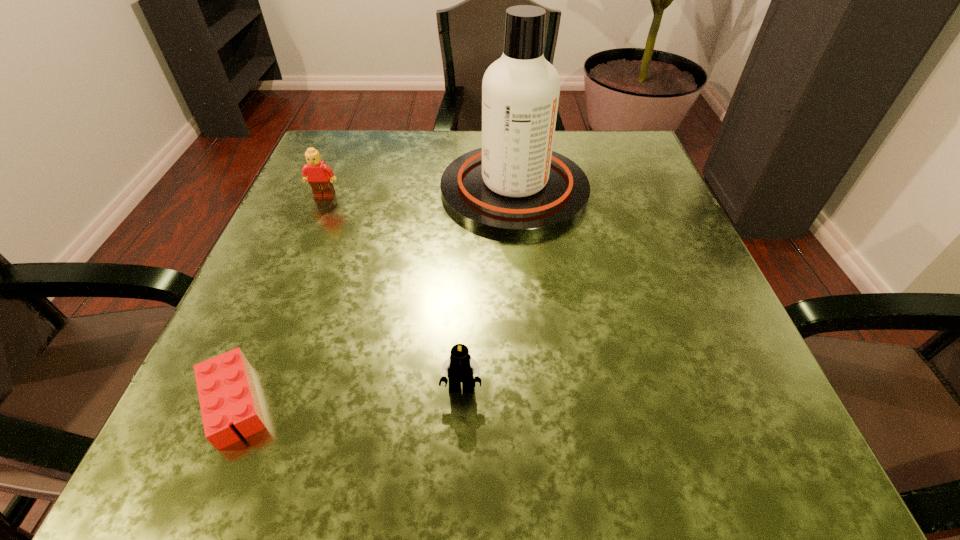
The height and width of the screenshot is (540, 960). Find the location of `object that is positioned at the far edge`. object that is positioned at the far edge is located at coordinates (515, 186).

I want to click on object that is at the near edge, so click(x=227, y=394).

Where is `object that is positioned at the right edge`? This screenshot has height=540, width=960. object that is positioned at the right edge is located at coordinates (515, 186).

You are a GUI agent. You are given a task and a screenshot of the screen. Output one action in this format:
    pyautogui.click(x=<x>, y=<y>)
    Task: Click on the object that is at the near left corner
    The width and height of the screenshot is (960, 540).
    Given the screenshot: What is the action you would take?
    pyautogui.click(x=227, y=394)

You are a GUI agent. You are given a task and a screenshot of the screen. Output one action in this format:
    pyautogui.click(x=<x>, y=<y>)
    Task: Click on the object situated at the far right corner
    The image size is (960, 540).
    Given the screenshot: What is the action you would take?
    pyautogui.click(x=515, y=186)

This screenshot has height=540, width=960. Find the location of `vacant space at the far edge of the desktop`. vacant space at the far edge of the desktop is located at coordinates (439, 185).

This screenshot has width=960, height=540. I want to click on blank space at the near edge of the desktop, so click(x=346, y=429).

In the image, there is a desktop. Where is `free space at the right edge`? This screenshot has width=960, height=540. free space at the right edge is located at coordinates (703, 347).

What are the coordinates of `vacant space at the far left corner` in the screenshot? It's located at (336, 149).

You are a GUI agent. You are given a task and a screenshot of the screen. Output one action in this format:
    pyautogui.click(x=<x>, y=<y>)
    Task: Click on the vacant region at the near left corner of the desktop
    
    Given the screenshot: What is the action you would take?
    pyautogui.click(x=253, y=487)